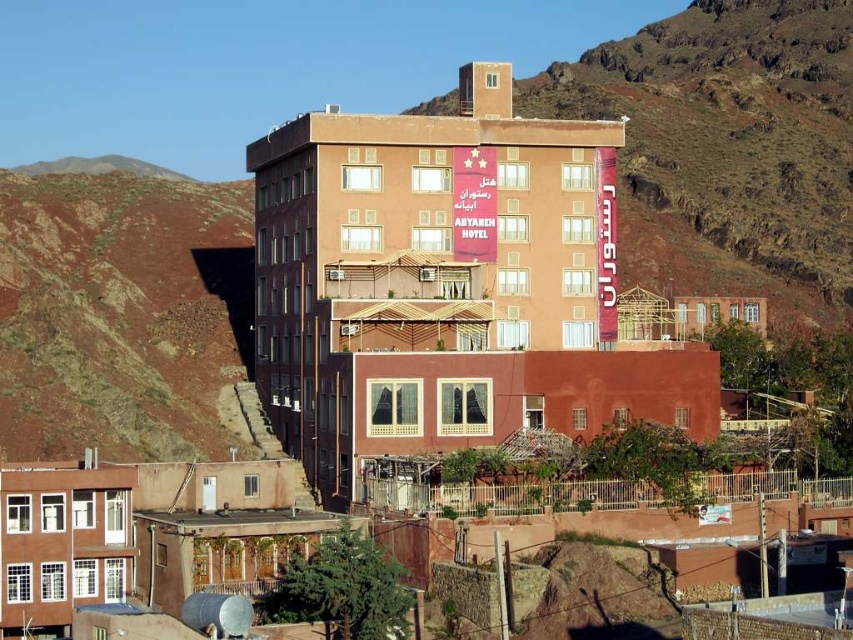
You are a painter planning to paint the matte orange building at center and the rustic clay hillside at left. Which object requires more paint if they have the same height?

The rustic clay hillside at left requires more paint because it is wider than the matte orange building at center, assuming they have the same height.

You are planning to install a new security camera that has a 50 meter range. You need to monitor both the matte orange building at center and orange clay building at center. Based on their distance, will the camera be able to cover both buildings within its range?

The matte orange building at center and orange clay building at center are 55.04 meters apart. Since the camera has a 50 meter range, it cannot cover both buildings within its range as the distance exceeds the camera range.

You are a delivery driver approaching the matte orange building at center and the rustic clay hillside at left. Which one is closer to the road?

The matte orange building at center is closer to the road because it is located below the rustic clay hillside at left, meaning it is situated lower in elevation and likely nearer to the road.